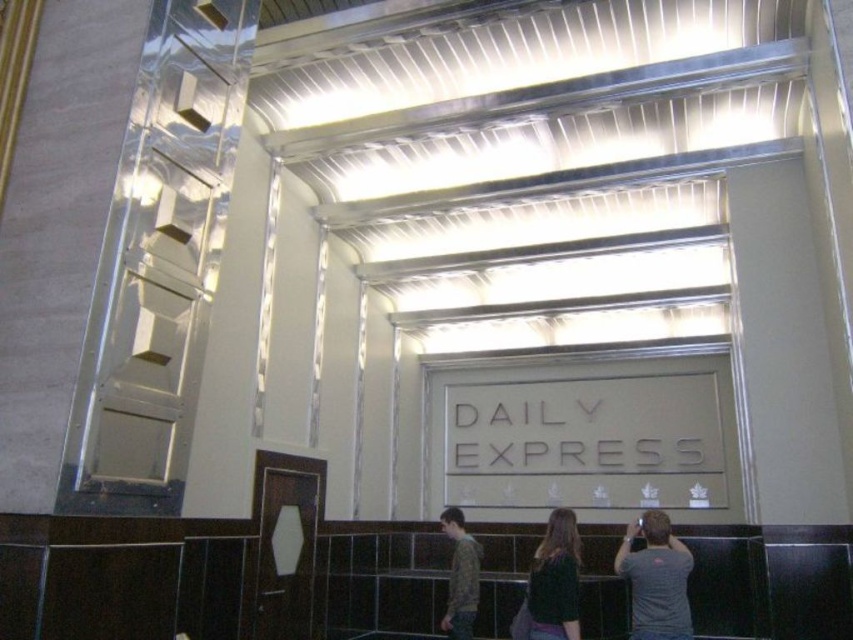
You are standing in the modern interior space and want to determine the relative positions of two points marked in the image. Which point is closer to you, point (566, 564) or point (454, 572)?

Point (566, 564) is closer to the camera than point (454, 572).